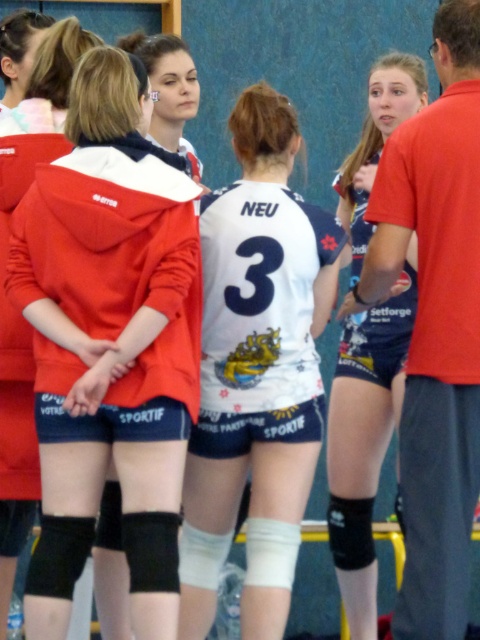
Is matte red hoodie at center further to the viewer compared to blue jersey shorts at center?

No, matte red hoodie at center is in front of blue jersey shorts at center.

What do you see at coordinates (108, 342) in the screenshot?
I see `matte red hoodie at center` at bounding box center [108, 342].

Between point (196, 326) and point (359, 420), which one is positioned in front?

Positioned in front is point (196, 326).

Find the location of a particular element. The height and width of the screenshot is (640, 480). matte red hoodie at center is located at coordinates (108, 342).

Between point (120, 188) and point (260, 108), which one is positioned behind?

Positioned behind is point (260, 108).

Can you confirm if matte red hoodie at center is shorter than white jersey at center?

Yes, matte red hoodie at center is shorter than white jersey at center.

Where is `matte red hoodie at center`? The height and width of the screenshot is (640, 480). matte red hoodie at center is located at coordinates (108, 342).

Where is `white jersey at center`? Image resolution: width=480 pixels, height=640 pixels. white jersey at center is located at coordinates (256, 371).

Between white jersey at center and blue jersey shorts at center, which one is positioned higher?

Positioned higher is white jersey at center.

Which is behind, point (291, 216) or point (348, 240)?

The point (348, 240) is behind.

Locate an element on the screen. The height and width of the screenshot is (640, 480). white jersey at center is located at coordinates (256, 371).